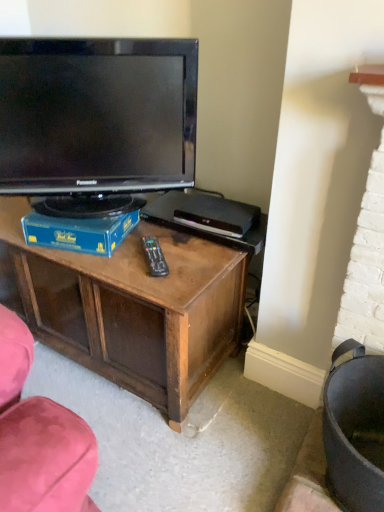
Question: Considering the relative sizes of blue cardboard box at center and black glossy television at upper left in the image provided, is blue cardboard box at center bigger than black glossy television at upper left?

Choices:
 (A) yes
 (B) no

Answer: (B)

Question: From a real-world perspective, is blue cardboard box at center located higher than black glossy television at upper left?

Choices:
 (A) no
 (B) yes

Answer: (A)

Question: Is blue cardboard box at center completely or partially outside of black glossy television at upper left?

Choices:
 (A) yes
 (B) no

Answer: (A)

Question: Is the position of blue cardboard box at center more distant than that of black glossy television at upper left?

Choices:
 (A) no
 (B) yes

Answer: (B)

Question: Is blue cardboard box at center aimed at black glossy television at upper left?

Choices:
 (A) yes
 (B) no

Answer: (B)

Question: From a real-world perspective, is blue cardboard box at center under black glossy television at upper left?

Choices:
 (A) yes
 (B) no

Answer: (A)

Question: From a real-world perspective, is black glossy television at upper left physically below blue cardboard box at center?

Choices:
 (A) no
 (B) yes

Answer: (A)

Question: Is black glossy television at upper left shorter than blue cardboard box at center?

Choices:
 (A) yes
 (B) no

Answer: (B)

Question: Is black glossy television at upper left positioned with its back to blue cardboard box at center?

Choices:
 (A) no
 (B) yes

Answer: (A)

Question: Considering the relative sizes of black glossy television at upper left and blue cardboard box at center in the image provided, is black glossy television at upper left smaller than blue cardboard box at center?

Choices:
 (A) yes
 (B) no

Answer: (B)

Question: Is black glossy television at upper left thinner than blue cardboard box at center?

Choices:
 (A) no
 (B) yes

Answer: (B)

Question: From the image's perspective, does black glossy television at upper left appear higher than blue cardboard box at center?

Choices:
 (A) no
 (B) yes

Answer: (B)

Question: Does blue cardboard box at center contain black plastic remote at center?

Choices:
 (A) no
 (B) yes

Answer: (A)